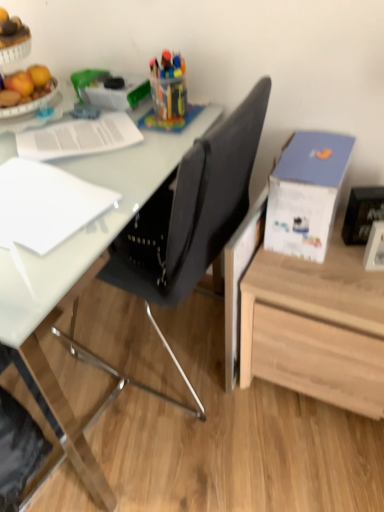
Question: Considering the positions of white paper at upper left, placed as the 2th notebook when sorted from bottom to top, and black fabric chair at center in the image, is white paper at upper left, placed as the 2th notebook when sorted from bottom to top, taller or shorter than black fabric chair at center?

Choices:
 (A) short
 (B) tall

Answer: (A)

Question: From a real-world perspective, is white paper at upper left, acting as the 1th notebook starting from the top, physically located above or below black fabric chair at center?

Choices:
 (A) below
 (B) above

Answer: (B)

Question: Which is farther from the white glossy picture frame at lower right, positioned as the 2th picture frame in top-to-bottom order?

Choices:
 (A) black fabric chair at center
 (B) blue cardboard box at upper right
 (C) white paper at left, which appears as the first notebook when viewed from the front
 (D) black glossy picture frame at upper right, which is the 2th picture frame in bottom-to-top order
 (E) white paper at upper left, the second notebook positioned from the front

Answer: (E)

Question: Which object is the closest to the blue cardboard box at upper right?

Choices:
 (A) black fabric chair at center
 (B) white glossy picture frame at lower right, which is the 1th picture frame in bottom-to-top order
 (C) white paper at upper left, the second notebook positioned from the front
 (D) white paper at left, which ranks as the second notebook in back-to-front order
 (E) black glossy picture frame at upper right, which is the 2th picture frame in bottom-to-top order

Answer: (A)